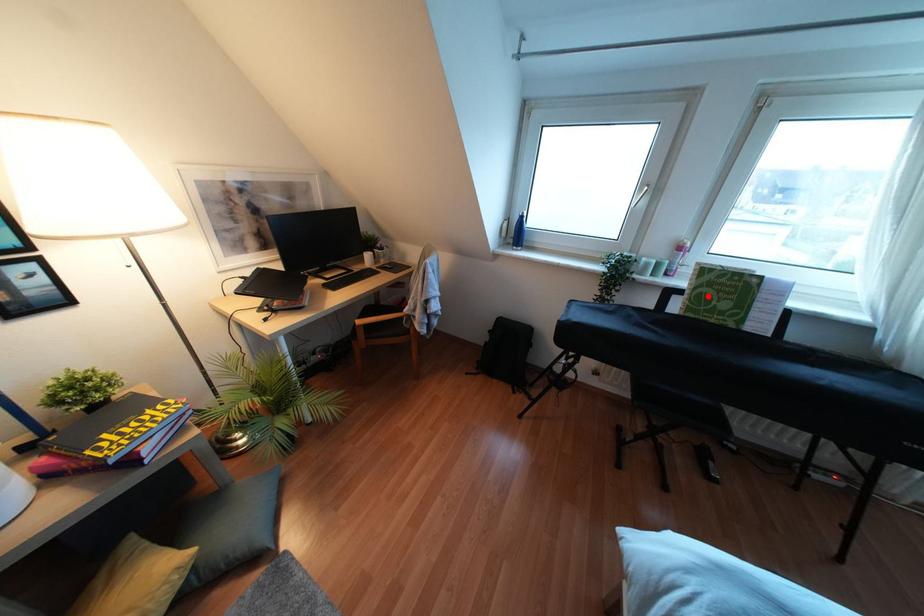
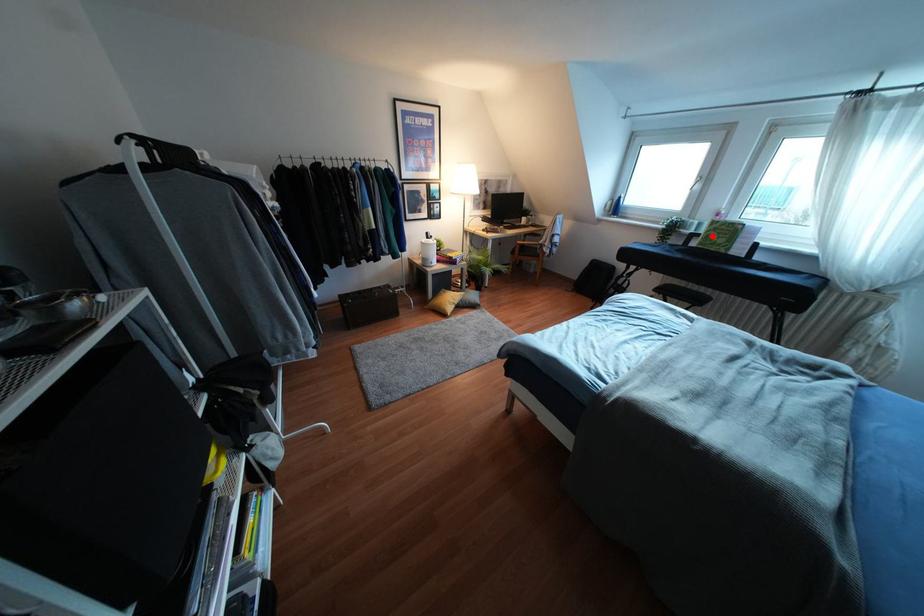
I am providing you with two images of the same scene from different viewpoints. A red point is marked on the first image and another point is marked on the second image. Do the highlighted points in image1 and image2 indicate the same real-world spot?

Yes